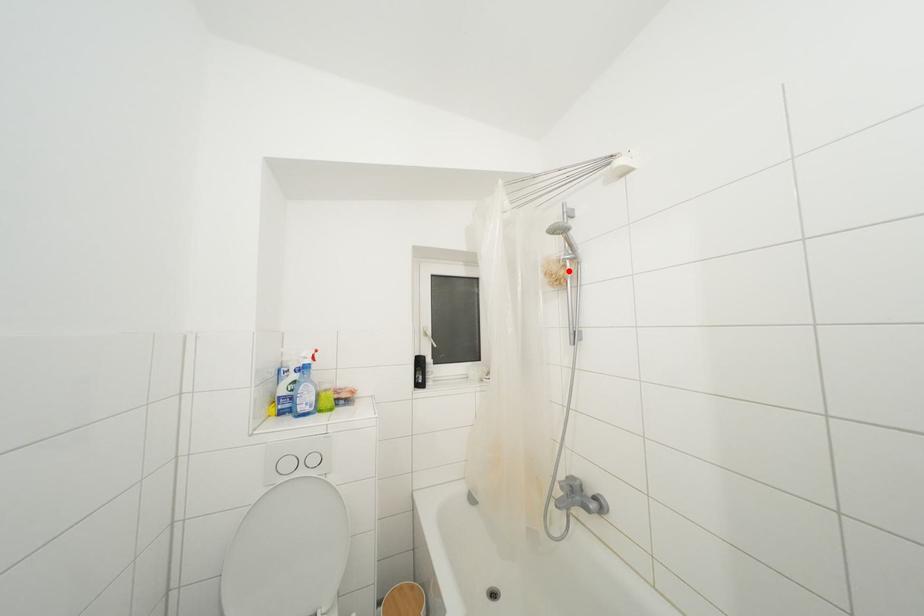
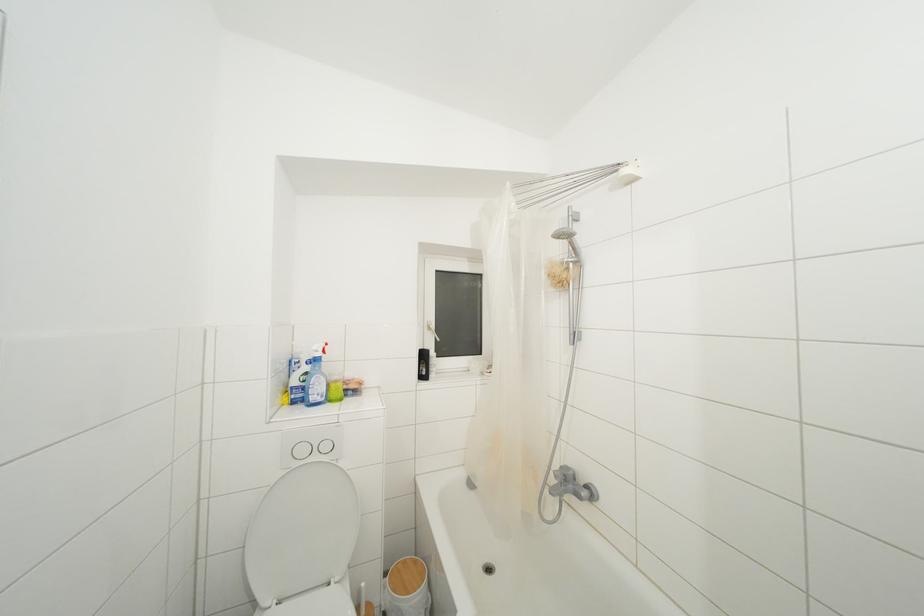
The point at the highlighted location is marked in the first image. Where is the corresponding point in the second image?

(572, 273)